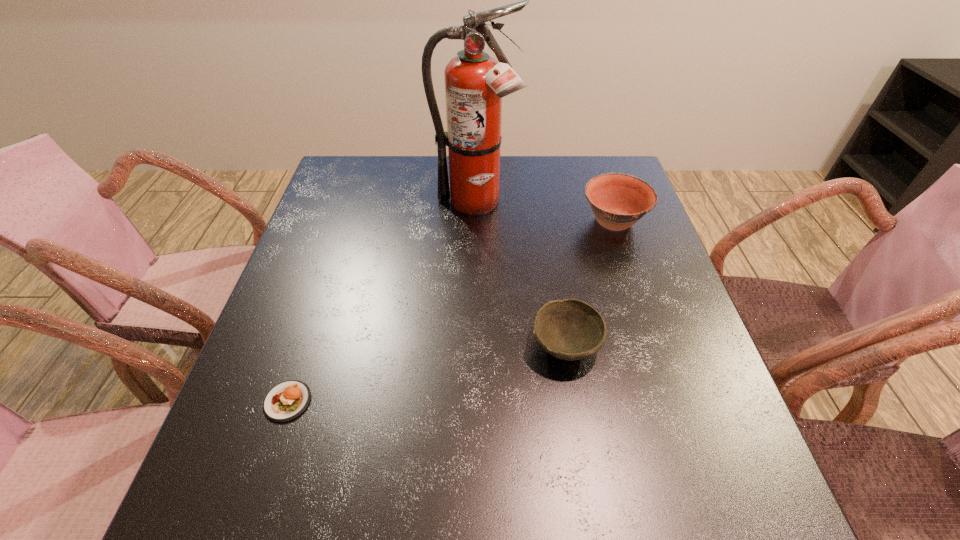
The width and height of the screenshot is (960, 540). I want to click on vacant space positioned 0.150m on the left of the third farthest object, so click(x=455, y=346).

The image size is (960, 540). I want to click on vacant area situated 0.200m on the right of the nearest object, so click(421, 401).

The height and width of the screenshot is (540, 960). I want to click on fire extinguisher present at the far edge, so click(x=475, y=82).

At what (x,y) coordinates should I click in order to perform the action: click on bowl located in the far edge section of the desktop. Please return your answer as a coordinate pair (x, y). Looking at the image, I should click on (618, 200).

Find the location of a particular element. This screenshot has height=540, width=960. object that is positioned at the left edge is located at coordinates (286, 401).

The height and width of the screenshot is (540, 960). In order to click on object that is at the right edge in this screenshot , I will do `click(618, 200)`.

I want to click on object present at the far right corner, so click(618, 200).

You are a GUI agent. You are given a task and a screenshot of the screen. Output one action in this format:
    pyautogui.click(x=<x>, y=<y>)
    Task: Click on the vacant region at the far edge
    This screenshot has height=540, width=960.
    Given the screenshot: What is the action you would take?
    pyautogui.click(x=407, y=176)

In the image, there is a desktop. Find the location of `vacant space at the near edge`. vacant space at the near edge is located at coordinates (368, 477).

Find the location of a particular element. Image resolution: width=960 pixels, height=540 pixels. vacant space at the left edge of the desktop is located at coordinates (363, 234).